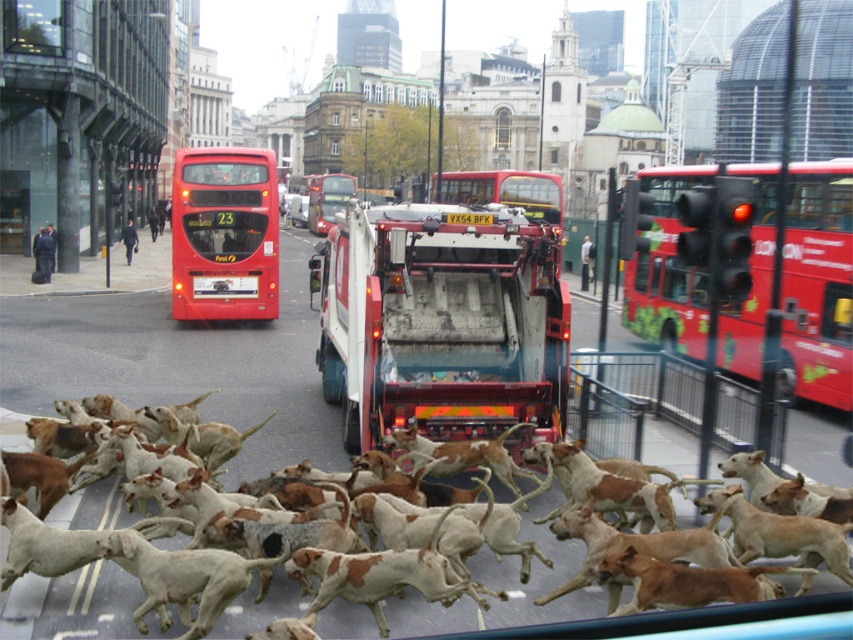
Does point (529, 580) come closer to viewer compared to point (339, 186)?

Yes, it is in front of point (339, 186).

Is point (56, 589) farther from viewer compared to point (337, 195)?

That is False.

You are a GUI agent. You are given a task and a screenshot of the screen. Output one action in this format:
    pyautogui.click(x=<x>, y=<y>)
    Task: Click on the speckled fur dogs at center
    The width and height of the screenshot is (853, 640).
    Given the screenshot: What is the action you would take?
    pyautogui.click(x=537, y=579)

Between red matte bus at upper right and white plastic license plate at center, which one has more height?

red matte bus at upper right

Which is behind, point (843, 353) or point (231, 285)?

Positioned behind is point (231, 285).

The width and height of the screenshot is (853, 640). Find the location of `red matte bus at upper right`. red matte bus at upper right is located at coordinates (817, 284).

Which is below, red matte bus at upper right or red rubber bus at center?

red matte bus at upper right

From the picture: Which of these two, red matte bus at upper right or red rubber bus at center, stands taller?

red rubber bus at center is taller.

This screenshot has height=640, width=853. Describe the element at coordinates (817, 284) in the screenshot. I see `red matte bus at upper right` at that location.

The height and width of the screenshot is (640, 853). I want to click on red matte bus at upper right, so click(817, 284).